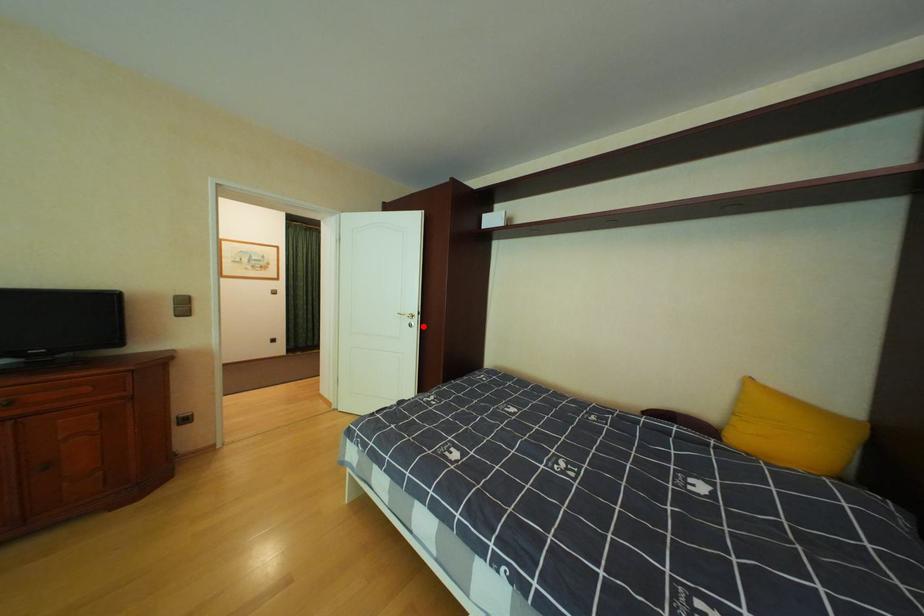
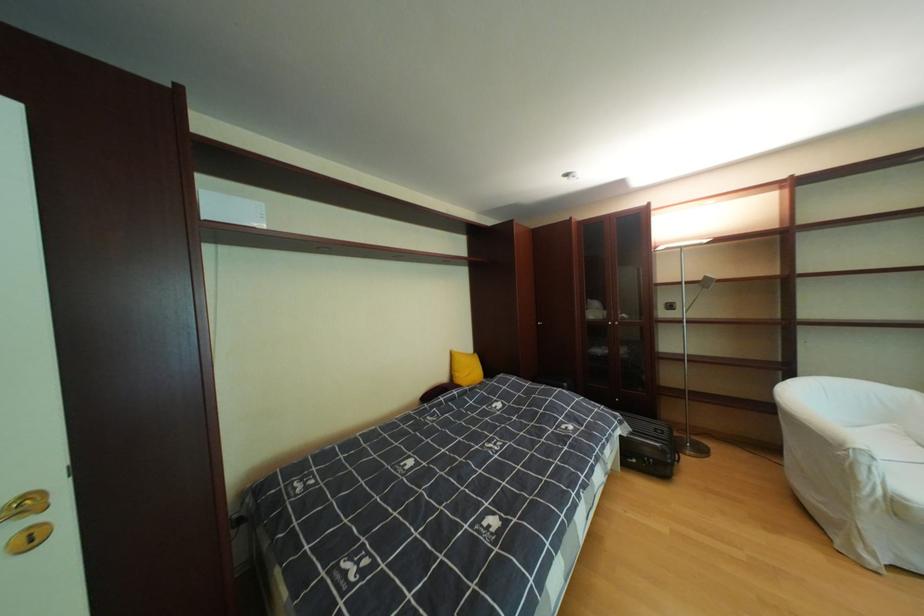
Where in the second image is the point corresponding to the highlighted location from the first image?

(43, 541)